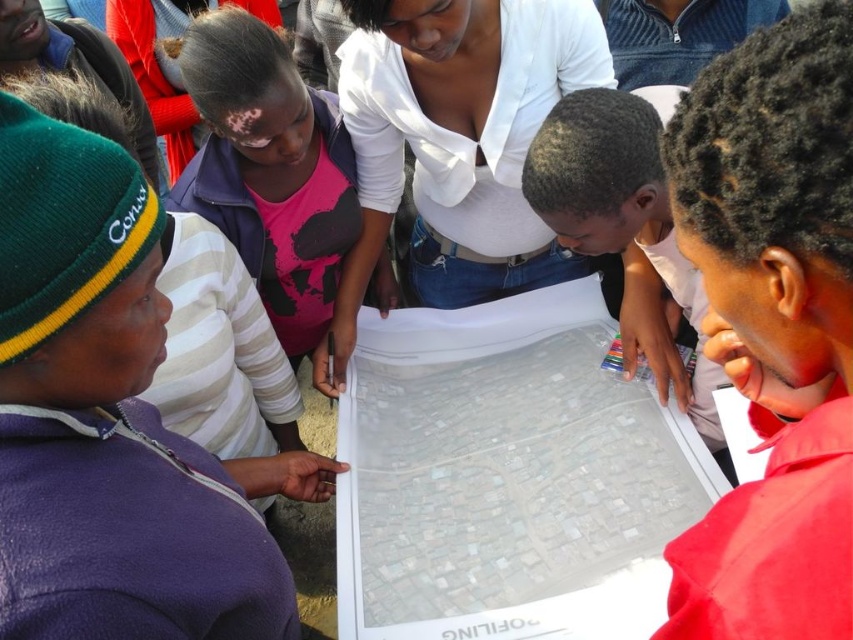
Question: Estimate the real-world distances between objects in this image. Which object is farther from the smooth red shirt at lower right?

Choices:
 (A) white matte shirt at center
 (B) pink matte shirt at upper center

Answer: (B)

Question: Can you confirm if smooth red shirt at lower right is positioned below pink matte shirt at upper center?

Choices:
 (A) yes
 (B) no

Answer: (A)

Question: Which of the following is the farthest from the observer?

Choices:
 (A) pink matte shirt at upper center
 (B) smooth red shirt at lower right
 (C) white matte shirt at center

Answer: (A)

Question: Estimate the real-world distances between objects in this image. Which object is farther from the smooth red shirt at lower right?

Choices:
 (A) pink matte shirt at upper center
 (B) white matte shirt at center

Answer: (A)

Question: From the image, what is the correct spatial relationship of smooth red shirt at lower right in relation to pink matte shirt at upper center?

Choices:
 (A) left
 (B) right

Answer: (B)

Question: Is smooth red shirt at lower right bigger than white matte shirt at center?

Choices:
 (A) no
 (B) yes

Answer: (A)